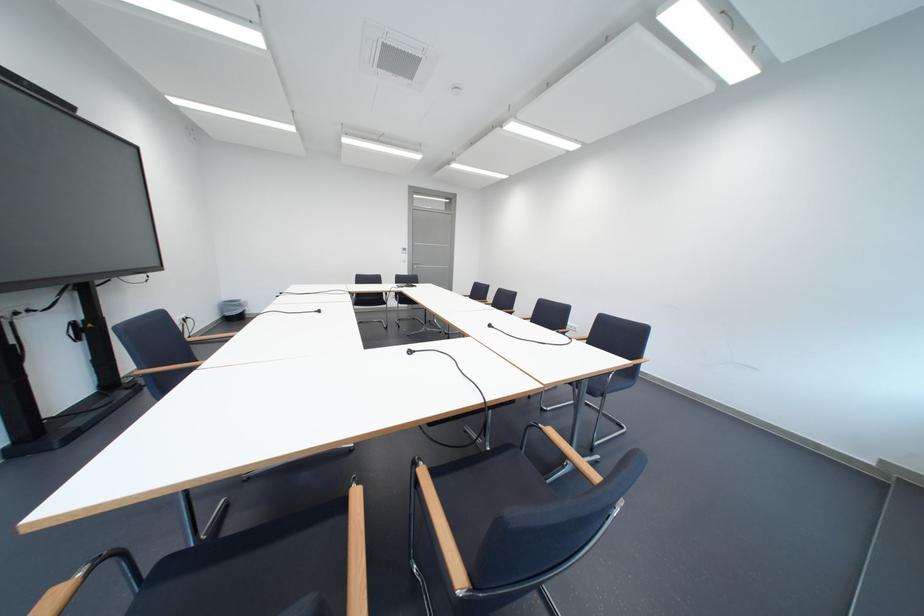
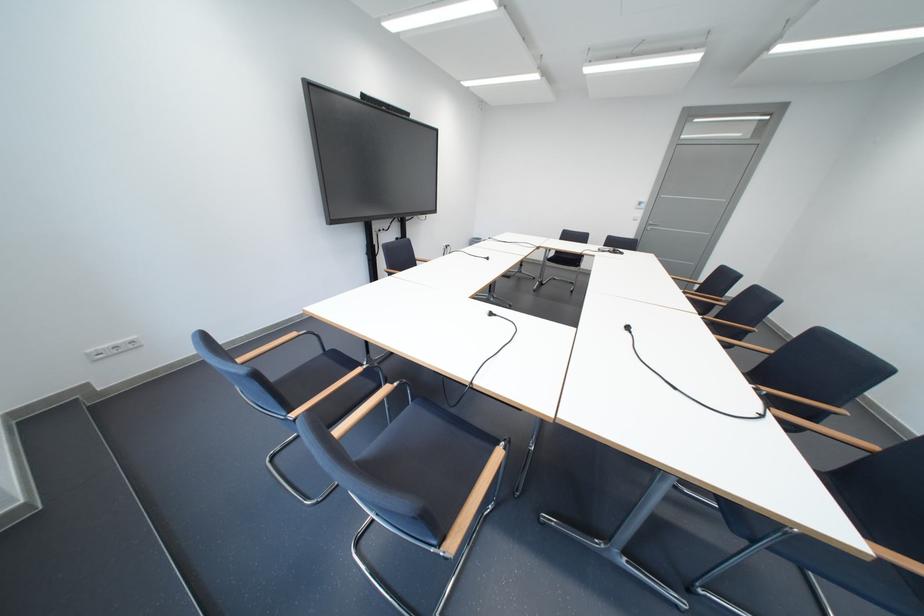
Find the pixel in the second image that matches point (422, 354) in the first image.

(503, 315)